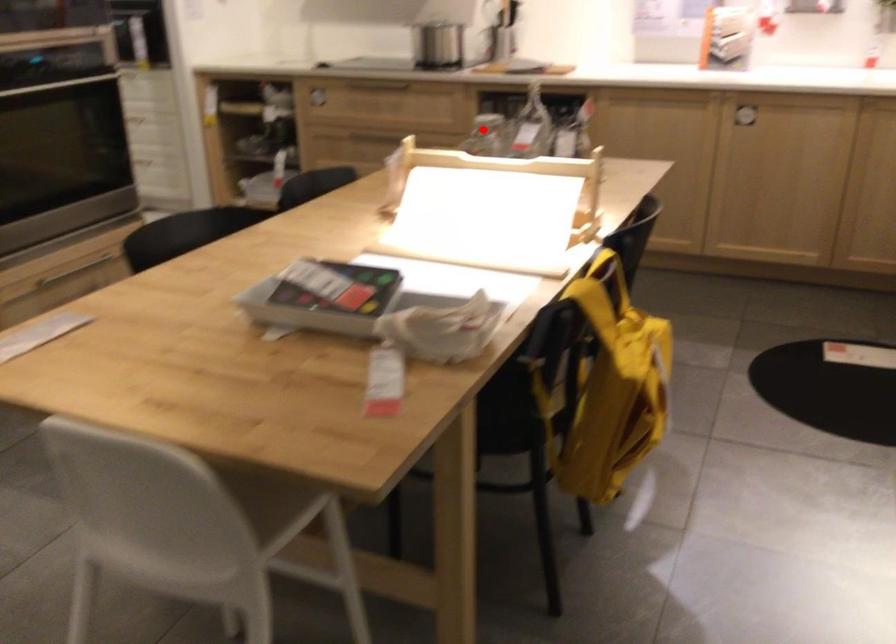
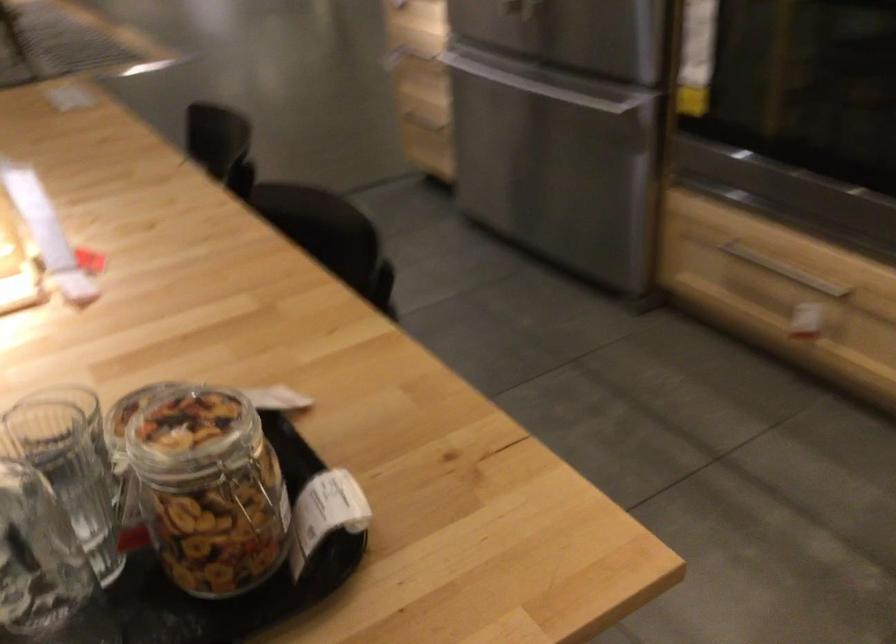
Find the pixel in the second image that matches the highlighted location in the first image.

(250, 493)